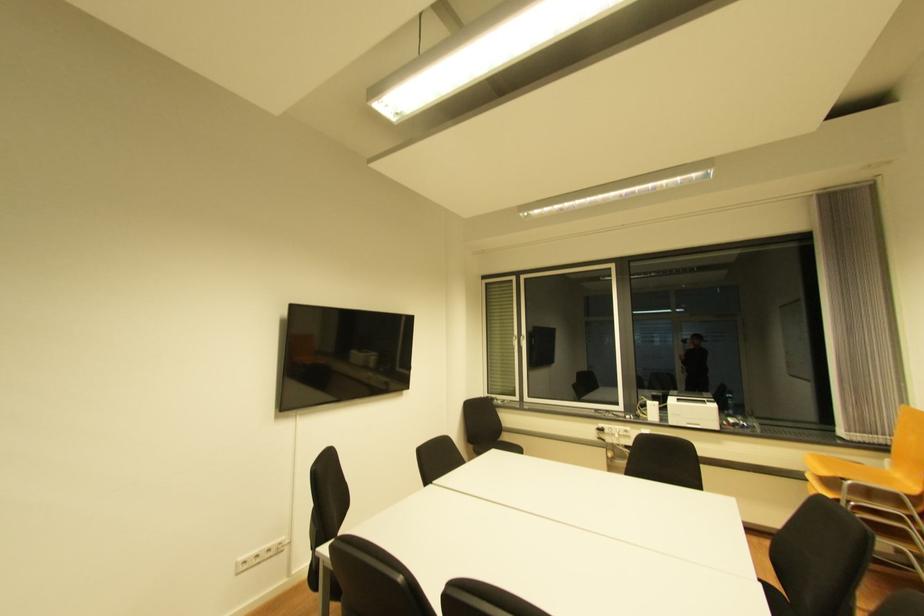
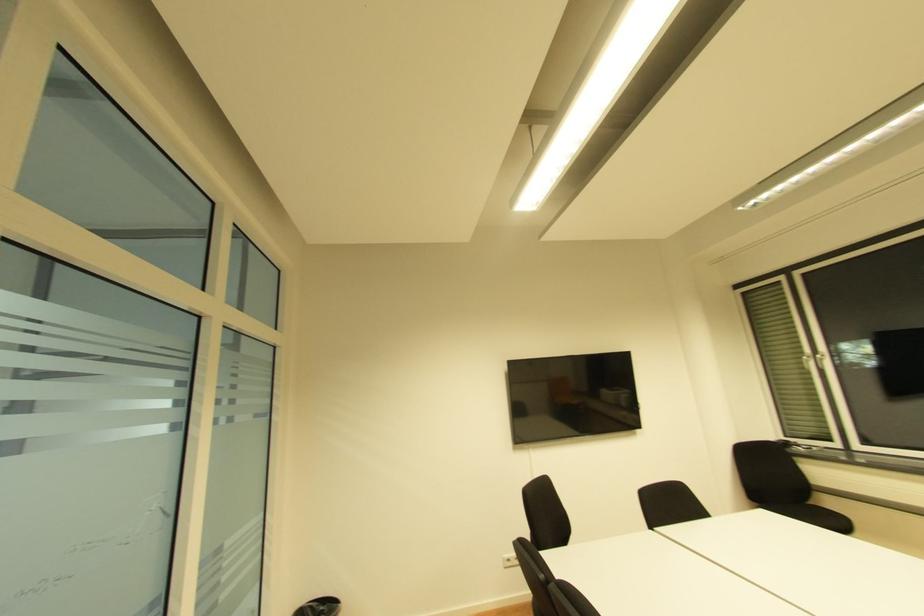
Question: Based on the continuous images, in which direction is the camera rotating? Reply with the corresponding letter.

Choices:
 (A) Left
 (B) Right
 (C) Up
 (D) Down

Answer: (A)